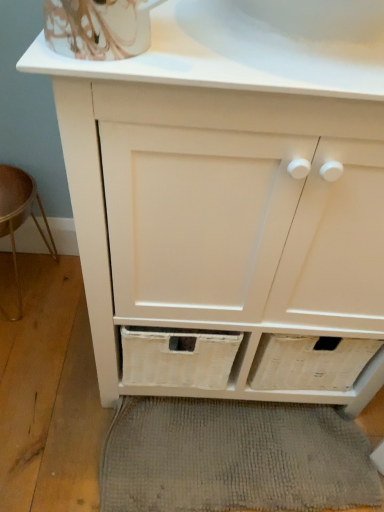
Question: Is wooden stool at lower left shorter than gray woven bath mat at lower center?

Choices:
 (A) yes
 (B) no

Answer: (B)

Question: Does wooden stool at lower left have a larger size compared to gray woven bath mat at lower center?

Choices:
 (A) no
 (B) yes

Answer: (B)

Question: Is wooden stool at lower left completely or partially outside of gray woven bath mat at lower center?

Choices:
 (A) no
 (B) yes

Answer: (B)

Question: From a real-world perspective, is wooden stool at lower left below gray woven bath mat at lower center?

Choices:
 (A) no
 (B) yes

Answer: (A)

Question: Considering the relative sizes of wooden stool at lower left and gray woven bath mat at lower center in the image provided, is wooden stool at lower left wider than gray woven bath mat at lower center?

Choices:
 (A) yes
 (B) no

Answer: (B)

Question: Is gray woven bath mat at lower center at the back of wooden stool at lower left?

Choices:
 (A) no
 (B) yes

Answer: (A)

Question: Can you confirm if gray woven bath mat at lower center is bigger than wooden stool at lower left?

Choices:
 (A) yes
 (B) no

Answer: (B)

Question: Is gray woven bath mat at lower center taller than wooden stool at lower left?

Choices:
 (A) no
 (B) yes

Answer: (A)

Question: From a real-world perspective, is gray woven bath mat at lower center physically above wooden stool at lower left?

Choices:
 (A) no
 (B) yes

Answer: (A)

Question: Is gray woven bath mat at lower center not within wooden stool at lower left?

Choices:
 (A) no
 (B) yes

Answer: (B)

Question: From the image's perspective, is gray woven bath mat at lower center above wooden stool at lower left?

Choices:
 (A) yes
 (B) no

Answer: (B)

Question: Can you confirm if gray woven bath mat at lower center is wider than wooden stool at lower left?

Choices:
 (A) no
 (B) yes

Answer: (B)

Question: Is white porcelain sink at upper center bigger than wooden stool at lower left?

Choices:
 (A) no
 (B) yes

Answer: (A)